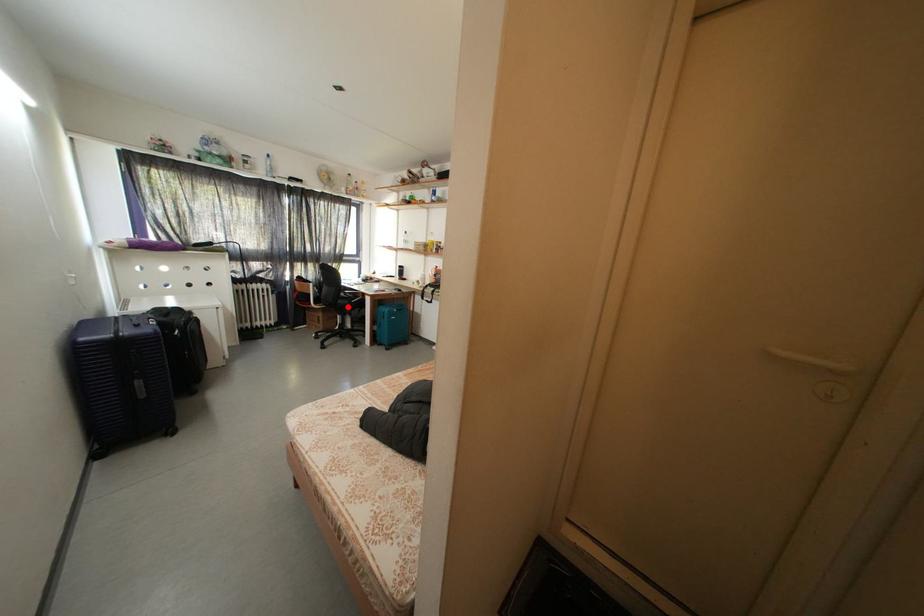
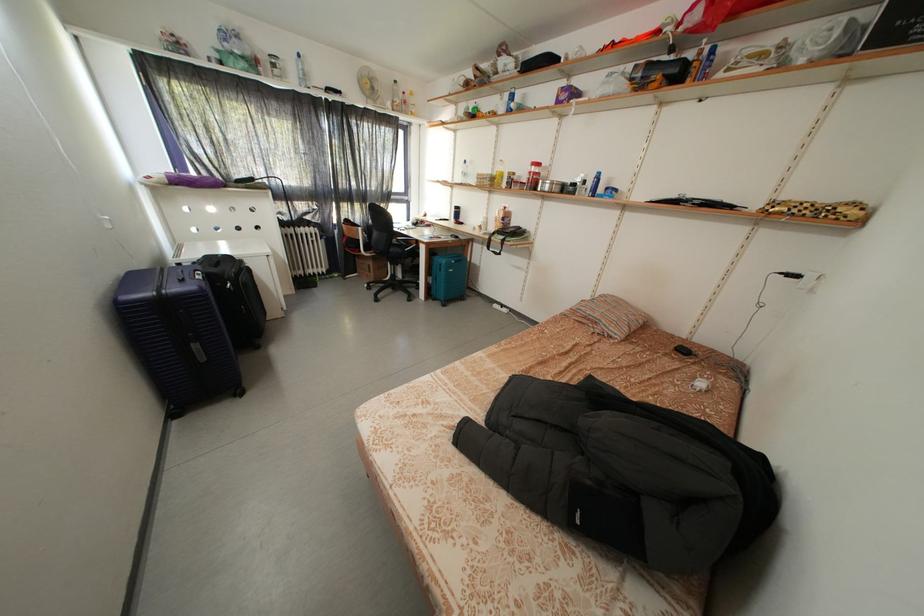
In the second image, find the point that corresponds to the highlighted location in the first image.

(399, 254)